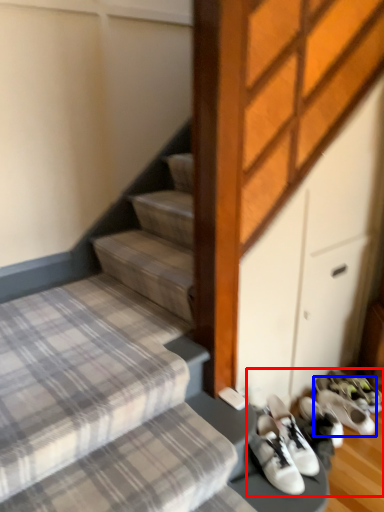
Question: Which object appears closest to the camera in this image, footwear (highlighted by a red box) or footwear (highlighted by a blue box)?

Choices:
 (A) footwear
 (B) footwear

Answer: (A)